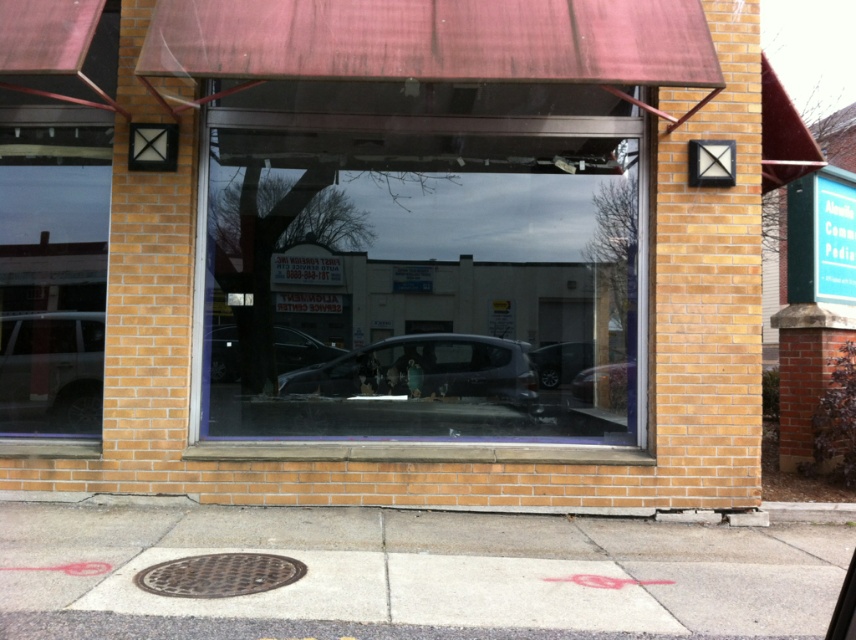
Is transparent glass window at center positioned before shiny black sedan at center?

Yes.

Between transparent glass window at center and shiny black sedan at center, which one appears on the left side from the viewer's perspective?

transparent glass window at center is more to the left.

Identify the location of transparent glass window at center. This screenshot has height=640, width=856. (420, 259).

Locate an element on the screen. The width and height of the screenshot is (856, 640). transparent glass window at center is located at coordinates (420, 259).

Is matte silver car at left bigger than brown concrete curb at lower center?

Correct, matte silver car at left is larger in size than brown concrete curb at lower center.

This screenshot has width=856, height=640. I want to click on matte silver car at left, so click(51, 372).

Is satin black car at center positioned at the back of matte black car at center?

That is False.

Between satin black car at center and matte black car at center, which one has more height?

With more height is satin black car at center.

Is point (319, 374) farther from camera compared to point (217, 358)?

Yes, point (319, 374) is behind point (217, 358).

The height and width of the screenshot is (640, 856). I want to click on satin black car at center, so click(425, 371).